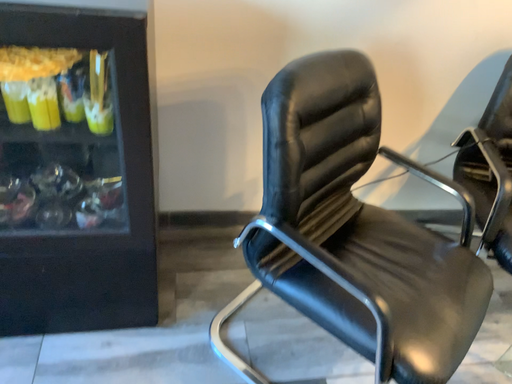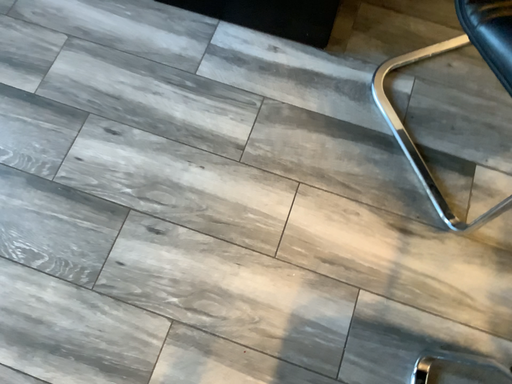
Question: Which way did the camera rotate in the video?

Choices:
 (A) rotated right
 (B) rotated left

Answer: (B)